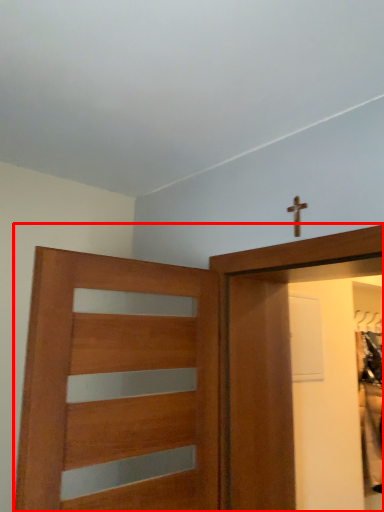
Question: From the image, what is the correct spatial relationship of door (annotated by the red box) in relation to crucifix?

Choices:
 (A) right
 (B) left

Answer: (B)